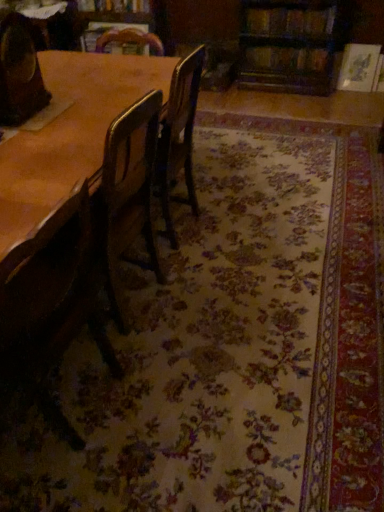
Question: From the image's perspective, is hardcover book at upper center, the second book positioned from the bottom, over hardcover book at upper right, the first book in the right-to-left sequence?

Choices:
 (A) no
 (B) yes

Answer: (B)

Question: From the image's perspective, does hardcover book at upper center, the 2th book positioned from the left, appear lower than hardcover book at upper right, acting as the third book starting from the left?

Choices:
 (A) yes
 (B) no

Answer: (B)

Question: Would you say hardcover book at upper center, placed as the second book when sorted from top to bottom, contains hardcover book at upper right, placed as the 3th book when sorted from top to bottom?

Choices:
 (A) no
 (B) yes

Answer: (A)

Question: Considering the relative sizes of hardcover book at upper center, the 2th book positioned from the left, and hardcover book at upper right, acting as the third book starting from the left, in the image provided, is hardcover book at upper center, the 2th book positioned from the left, bigger than hardcover book at upper right, acting as the third book starting from the left,?

Choices:
 (A) no
 (B) yes

Answer: (B)

Question: Is hardcover book at upper center, the 2th book positioned from the left, facing away from hardcover book at upper right, acting as the third book starting from the left?

Choices:
 (A) yes
 (B) no

Answer: (B)

Question: Is hardcover book at upper center, placed as the second book when sorted from top to bottom, completely or partially outside of hardcover book at upper right, the first book in the right-to-left sequence?

Choices:
 (A) no
 (B) yes

Answer: (B)

Question: Considering the relative positions of wooden table at center and wooden chair at left, positioned as the 1th chair in bottom-to-top order, in the image provided, is wooden table at center to the right of wooden chair at left, positioned as the 1th chair in bottom-to-top order, from the viewer's perspective?

Choices:
 (A) no
 (B) yes

Answer: (B)

Question: Does wooden table at center have a greater width compared to wooden chair at left, acting as the 2th chair starting from the top?

Choices:
 (A) no
 (B) yes

Answer: (B)

Question: From a real-world perspective, is wooden table at center under wooden chair at left, positioned as the 1th chair in bottom-to-top order?

Choices:
 (A) yes
 (B) no

Answer: (B)

Question: Is wooden table at center further to the viewer compared to wooden chair at left, acting as the 2th chair starting from the top?

Choices:
 (A) no
 (B) yes

Answer: (B)

Question: Is wooden table at center not within wooden chair at left, positioned as the 1th chair in bottom-to-top order?

Choices:
 (A) yes
 (B) no

Answer: (A)

Question: Considering the relative sizes of wooden table at center and wooden chair at left, positioned as the 1th chair in bottom-to-top order, in the image provided, is wooden table at center shorter than wooden chair at left, positioned as the 1th chair in bottom-to-top order,?

Choices:
 (A) yes
 (B) no

Answer: (B)

Question: Does wooden chair at left, positioned as the 1th chair in bottom-to-top order, have a smaller size compared to wooden chair at left, which is the first chair in top-to-bottom order?

Choices:
 (A) no
 (B) yes

Answer: (A)